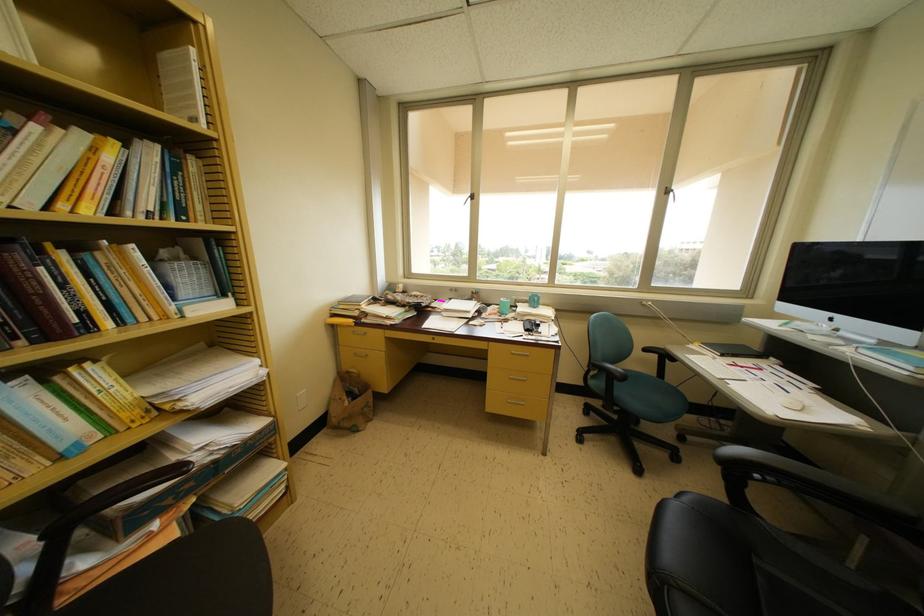
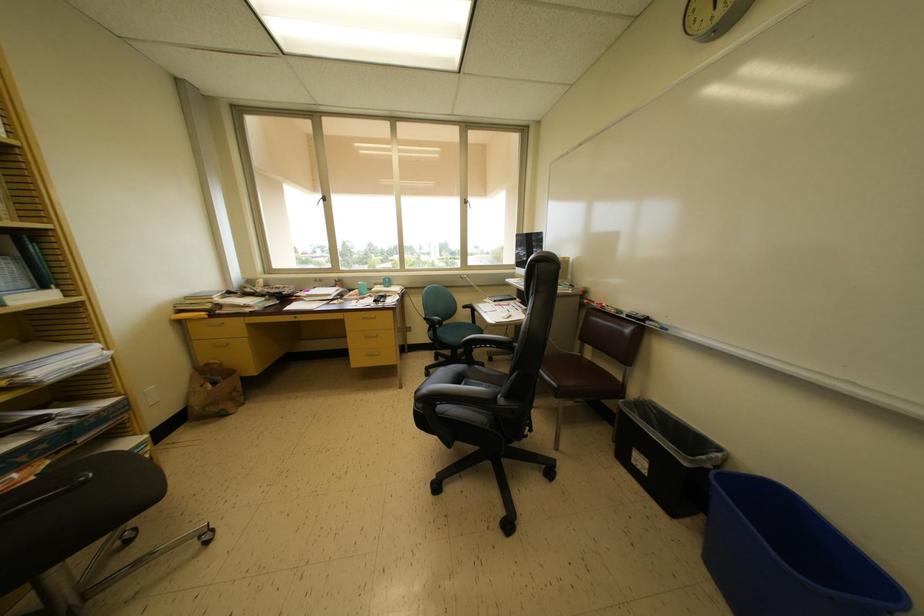
In a continuous first-person perspective shot, in which direction is the camera moving?

The cameraman moved toward right, backward.